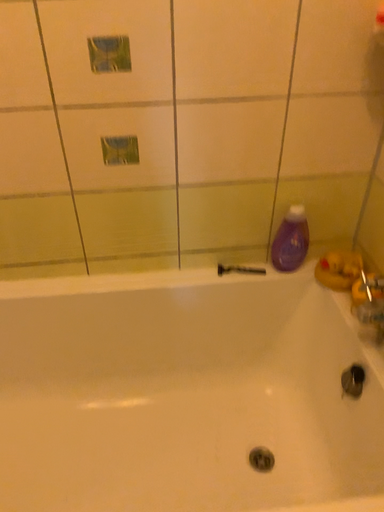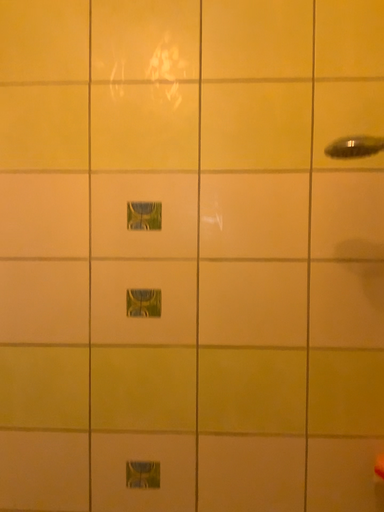
Question: Which way did the camera rotate in the video?

Choices:
 (A) rotated right
 (B) rotated left

Answer: (B)